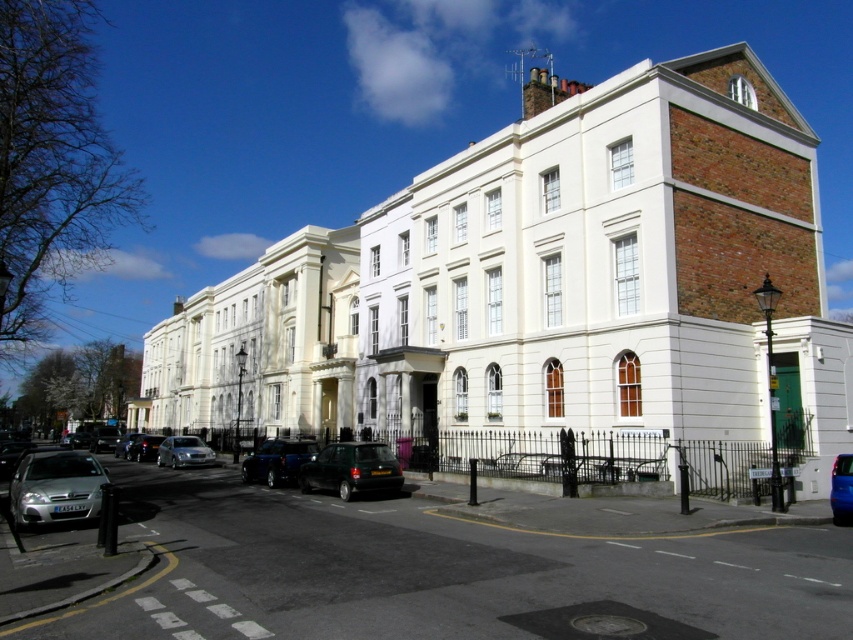
You are standing on the sidewalk in front of the classical buildings and see two cars parked in the street. Which car is closer to you, the dark green matte car at center or the silver metallic car at center?

The dark green matte car at center is closer to the viewer than the silver metallic car at center.

You are standing on the sidewalk in front of the classical buildings and see the shiny black suv at center and the shiny blue car at center. Which car is positioned more to the left side of the street?

The shiny black suv at center is positioned more to the left side of the street compared to the shiny blue car at center.

Based on the photo, you are a delivery person trying to park your van next to the silver metallic car at lower left. Can you fit your van, which is the same size as the shiny black suv at center, in the available space between them?

The shiny black suv at center is larger than the silver metallic car at lower left. Since your van is the same size as the shiny black suv at center, it would not fit in the space currently occupied by the silver metallic car at lower left.